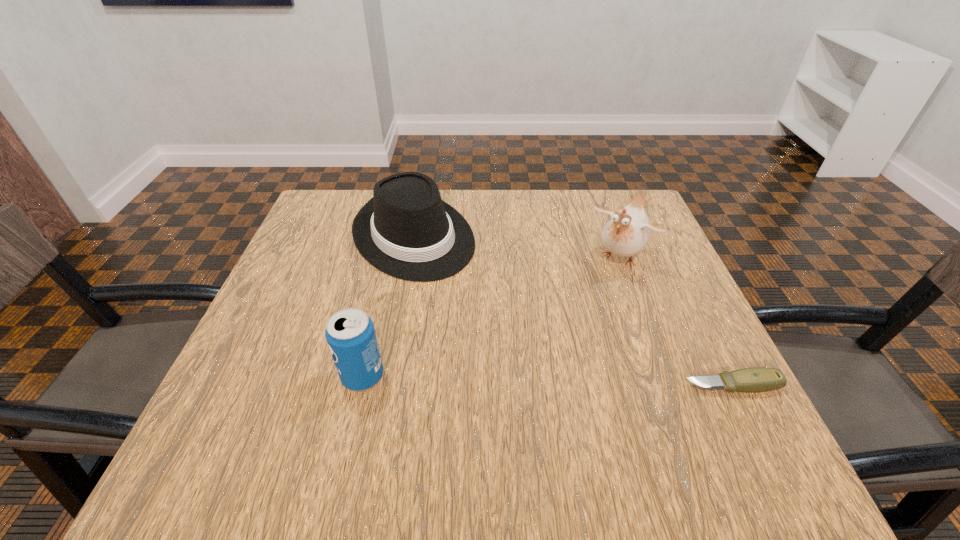
I want to click on object located in the far right corner section of the desktop, so click(626, 233).

Locate an element on the screen. object located at the near right corner is located at coordinates (757, 379).

Image resolution: width=960 pixels, height=540 pixels. In order to click on vacant space at the far edge of the desktop in this screenshot , I will do `click(508, 211)`.

In the image, there is a desktop. Identify the location of vacant space at the near edge. Image resolution: width=960 pixels, height=540 pixels. click(461, 416).

Identify the location of vacant space at the left edge. Image resolution: width=960 pixels, height=540 pixels. (339, 245).

Image resolution: width=960 pixels, height=540 pixels. I want to click on free space at the right edge of the desktop, so click(613, 258).

In the image, there is a desktop. At what (x,y) coordinates should I click in order to perform the action: click on free space at the far left corner. Please return your answer as a coordinate pair (x, y). This screenshot has height=540, width=960. Looking at the image, I should click on (315, 222).

The width and height of the screenshot is (960, 540). In the image, there is a desktop. Find the location of `free space at the near right corner`. free space at the near right corner is located at coordinates (702, 408).

Locate an element on the screen. This screenshot has width=960, height=540. vacant area that lies between the shortest object and the bird is located at coordinates (677, 322).

Image resolution: width=960 pixels, height=540 pixels. What are the coordinates of `vacant space in between the fedora and the pocketknife` in the screenshot? It's located at (573, 310).